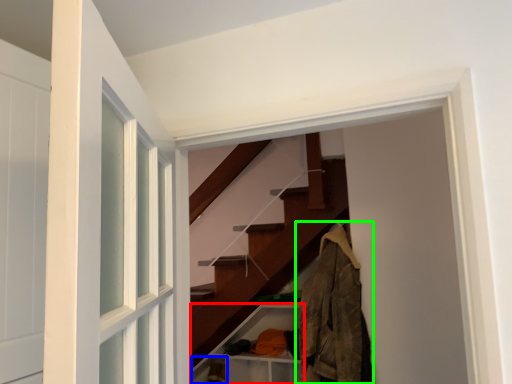
Question: Based on their relative distances, which object is nearer to cabinet (highlighted by a red box)? Choose from shelf (highlighted by a blue box) and clothing (highlighted by a green box).

Choices:
 (A) shelf
 (B) clothing

Answer: (A)